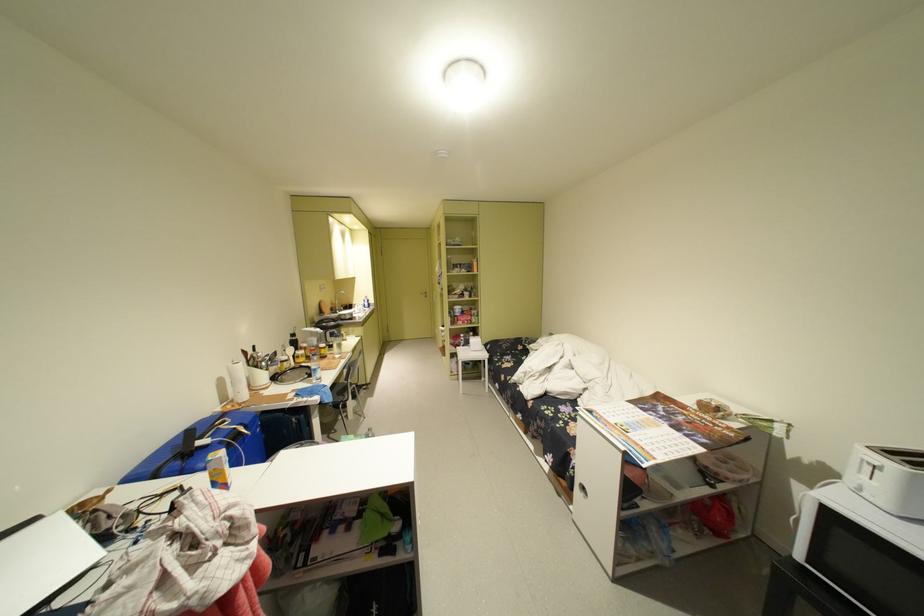
What do you see at coordinates (869, 463) in the screenshot? The image size is (924, 616). I see `a toaster lever` at bounding box center [869, 463].